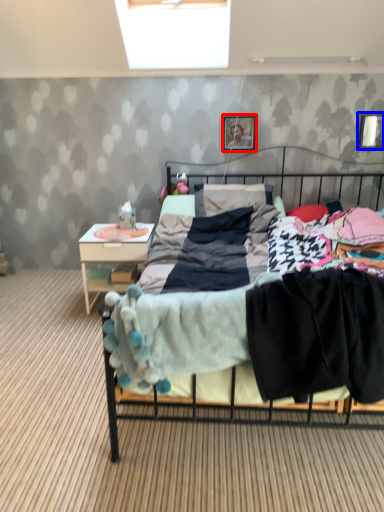
Question: Which object appears farthest to the camera in this image, picture frame (highlighted by a red box) or picture frame (highlighted by a blue box)?

Choices:
 (A) picture frame
 (B) picture frame

Answer: (A)